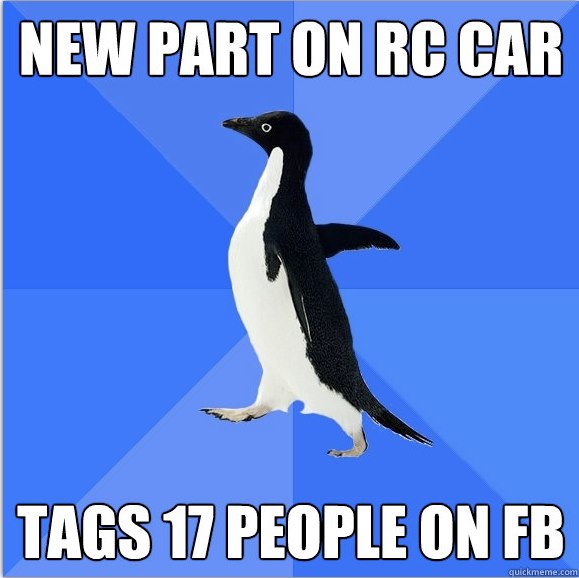
The width and height of the screenshot is (579, 578). I want to click on chest, so click(252, 258).